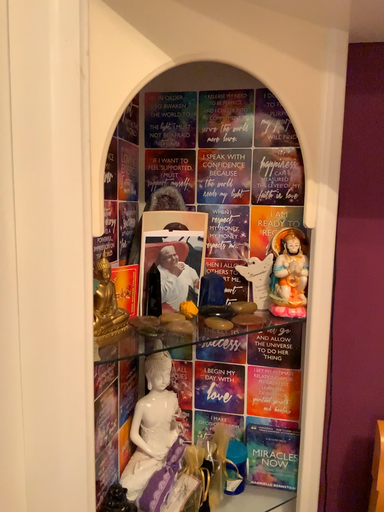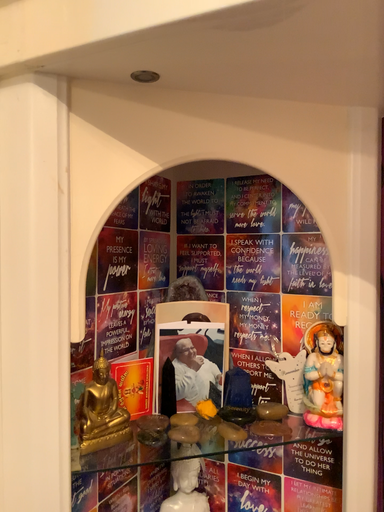
Question: How did the camera likely rotate when shooting the video?

Choices:
 (A) rotated left
 (B) rotated right

Answer: (A)